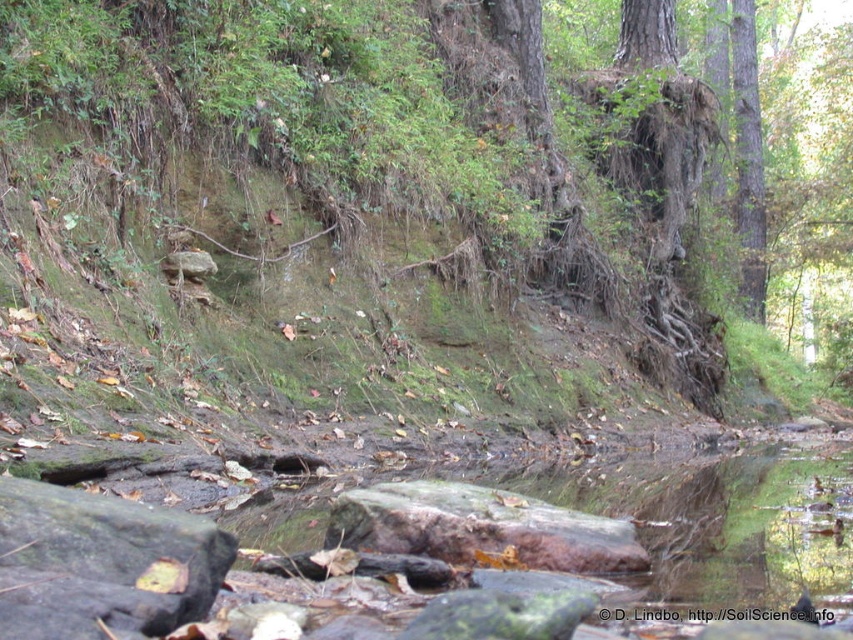
Consider the image. You are standing at the origin point of the image coordinate system. Where is the rusty wood log at center located in terms of its 2D coordinates?

The rusty wood log at center is located at the 2D coordinates of point (480,529).

You are standing at the edge of the stream and want to place a small decorative stone. You have the green mossy rock at lower left and the green rough bark tree at right. Which object is a better candidate for the stone placement in terms of size?

The green mossy rock at lower left is smaller than the green rough bark tree at right, so it is a better candidate for placing the small decorative stone due to its smaller size.

You are a hiker trying to cross a stream. You see a green mossy rock at lower left and a green rough bark tree at right. Which object can you use to step on to cross the stream?

The green mossy rock at lower left can be used to step on to cross the stream because it is positioned in the stream area. The green rough bark tree at right is likely on the bank and not suitable for stepping.